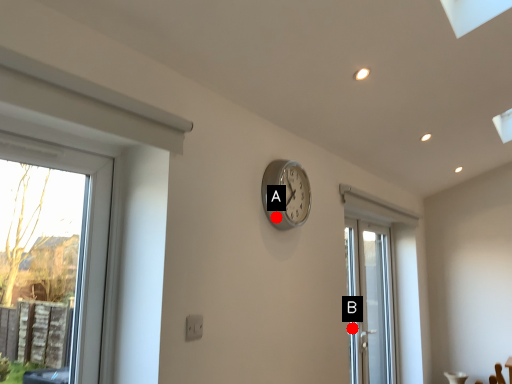
Question: Two points are circled on the image, labeled by A and B beside each circle. Which point is closer to the camera taking this photo?

Choices:
 (A) A is closer
 (B) B is closer

Answer: (A)